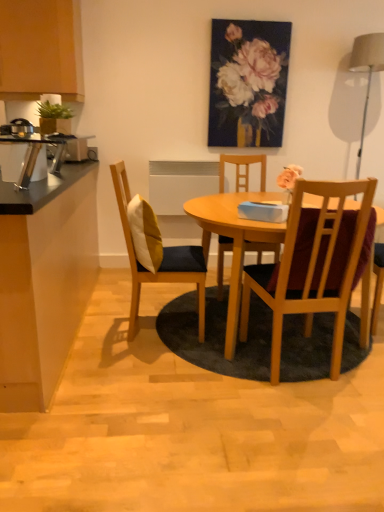
Question: Does wooden chair at center, the third chair viewed from the left, have a greater width compared to wooden chair with cushion at center, the 3th chair from the right?

Choices:
 (A) no
 (B) yes

Answer: (A)

Question: From the image's perspective, would you say wooden chair at center, which is the 1th chair in right-to-left order, is positioned over wooden chair with cushion at center, which is counted as the first chair, starting from the left?

Choices:
 (A) no
 (B) yes

Answer: (A)

Question: Considering the relative sizes of wooden chair at center, the third chair viewed from the left, and wooden chair with cushion at center, which is counted as the first chair, starting from the left, in the image provided, is wooden chair at center, the third chair viewed from the left, taller than wooden chair with cushion at center, which is counted as the first chair, starting from the left,?

Choices:
 (A) no
 (B) yes

Answer: (A)

Question: Is the depth of wooden chair at center, the third chair viewed from the left, less than that of wooden chair with cushion at center, which is counted as the first chair, starting from the left?

Choices:
 (A) no
 (B) yes

Answer: (B)

Question: Does wooden chair at center, the third chair viewed from the left, contain wooden chair with cushion at center, which is counted as the first chair, starting from the left?

Choices:
 (A) no
 (B) yes

Answer: (A)

Question: Is wooden chair at center, which is the 1th chair in right-to-left order, at the right side of wooden chair with cushion at center, which is counted as the first chair, starting from the left?

Choices:
 (A) no
 (B) yes

Answer: (B)

Question: From a real-world perspective, does yellow fabric pillow at left stand above wooden chair with cushion at center, which is counted as the first chair, starting from the left?

Choices:
 (A) no
 (B) yes

Answer: (B)

Question: Can you confirm if yellow fabric pillow at left is smaller than wooden chair with cushion at center, the 3th chair from the right?

Choices:
 (A) no
 (B) yes

Answer: (B)

Question: Is yellow fabric pillow at left aimed at wooden chair with cushion at center, the 3th chair from the right?

Choices:
 (A) yes
 (B) no

Answer: (A)

Question: Is yellow fabric pillow at left touching wooden chair with cushion at center, the 3th chair from the right?

Choices:
 (A) yes
 (B) no

Answer: (B)

Question: Is yellow fabric pillow at left wider than wooden chair with cushion at center, which is counted as the first chair, starting from the left?

Choices:
 (A) yes
 (B) no

Answer: (B)

Question: Is yellow fabric pillow at left far from wooden chair with cushion at center, the 3th chair from the right?

Choices:
 (A) no
 (B) yes

Answer: (A)

Question: Does wooden chair with cushion at center, the 3th chair from the right, turn towards brushed metal toaster at left, marked as the second appliance in a front-to-back arrangement?

Choices:
 (A) no
 (B) yes

Answer: (A)